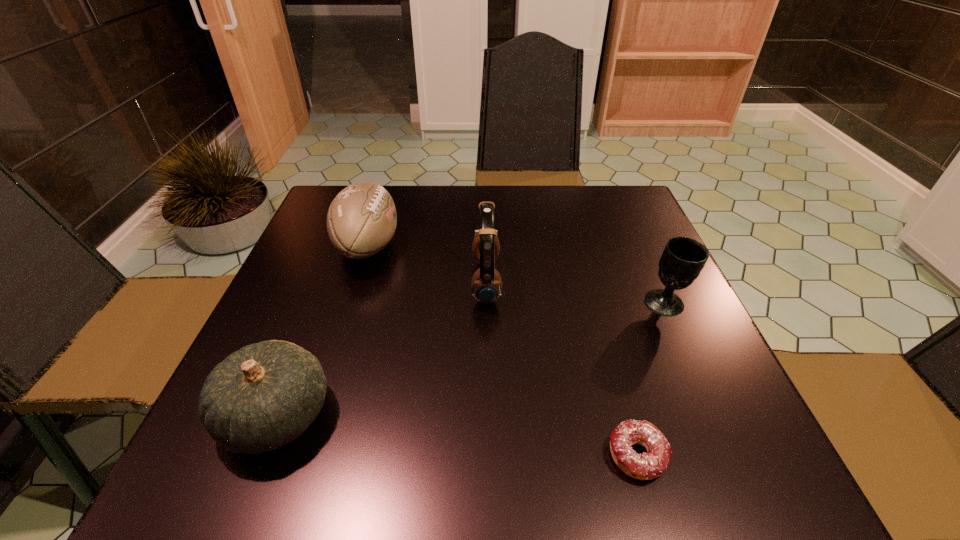
Where is `free space between the gourd and the tallest object`? The width and height of the screenshot is (960, 540). free space between the gourd and the tallest object is located at coordinates (381, 348).

Where is `object that is the third nearest to the second object from right to left`? Image resolution: width=960 pixels, height=540 pixels. object that is the third nearest to the second object from right to left is located at coordinates (265, 395).

This screenshot has height=540, width=960. I want to click on object that is the third closest to the gourd, so click(x=645, y=466).

Identify the location of blank area in the image that satisfies the following two spatial constraints: 1. on the back side of the rightmost object; 2. on the ear cup of the headset. (656, 282).

The height and width of the screenshot is (540, 960). What are the coordinates of `vacant area that satisfies the following two spatial constraints: 1. on the laces of the football (American); 2. on the right side of the second object from right to left` in the screenshot? It's located at (301, 456).

Identify the location of free point that satisfies the following two spatial constraints: 1. on the ear cup of the headset; 2. on the left side of the rightmost object. (487, 303).

Locate an element on the screen. This screenshot has width=960, height=540. free space that satisfies the following two spatial constraints: 1. on the front side of the gourd; 2. on the right side of the shortest object is located at coordinates (261, 456).